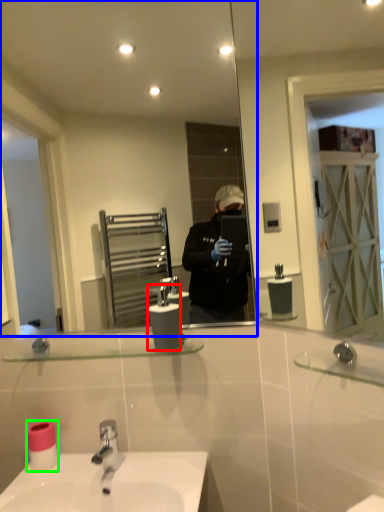
Question: Which is nearer to the soap dispenser (highlighted by a red box)? mirror (highlighted by a blue box) or toilet paper (highlighted by a green box).

Choices:
 (A) mirror
 (B) toilet paper

Answer: (B)